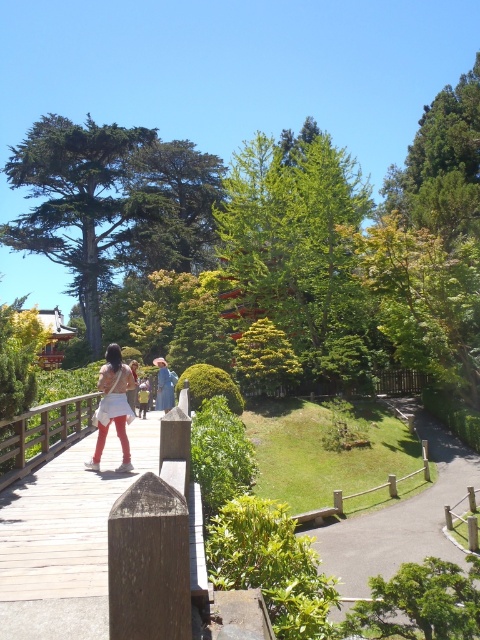
In the scene shown: Based on the scene description, where is the wooden bridge at center located in terms of its 2D coordinates?

The wooden bridge at center is located at the 2D coordinates of point [111,548].

Looking at this image, you are standing at the point closer to the camera in the scene. There are two points marked in the image, one at coordinates point(371, 570) and another at point(129, 380). If you want to walk towards the point that is further away from you, which coordinate should you head towards?

You should head towards point(371, 570) because it is behind point(129, 380), meaning it is farther away from your current position.